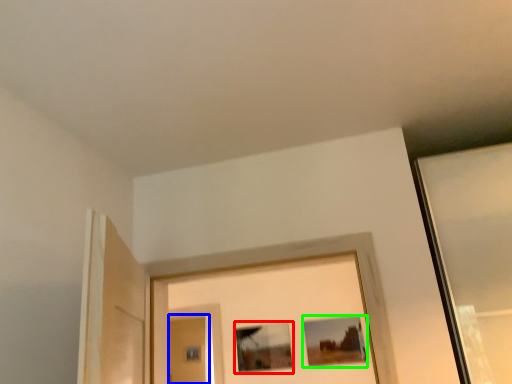
Question: Considering the real-world distances, which object is closest to picture frame (highlighted by a red box)? screen door (highlighted by a blue box) or picture frame (highlighted by a green box).

Choices:
 (A) screen door
 (B) picture frame

Answer: (B)